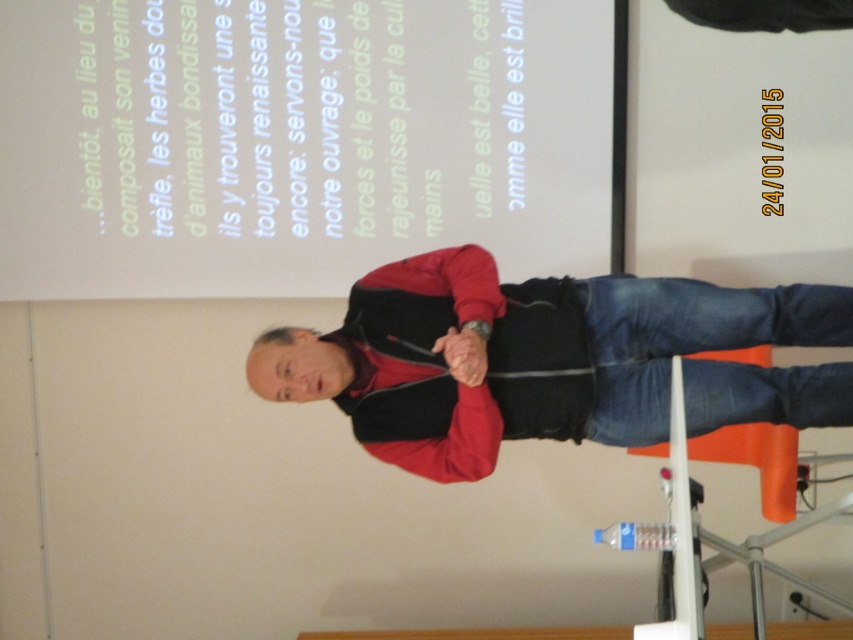
Consider the image. You are an assistant organizing a presentation. You need to place a decorative ribbon that is 1 meter long. The ribbon must be placed between the white paper at upper center and the blue denim jeans at lower center. Can the ribbon fit vertically between them?

The white paper at upper center has a greater height compared to blue denim jeans at lower center. Since the ribbon is 1 meter long and the vertical distance between them is not specified, we cannot determine if the ribbon will fit.

You are a photographer adjusting your camera to focus on the speaker. The red matte jacket at center and the blue denim jeans at lower center are both in the frame. Which object should you focus on first to ensure the speaker is in sharp focus?

You should focus on the red matte jacket at center first because it is closer to the viewer than the blue denim jeans at lower center, ensuring the speaker is in sharp focus.